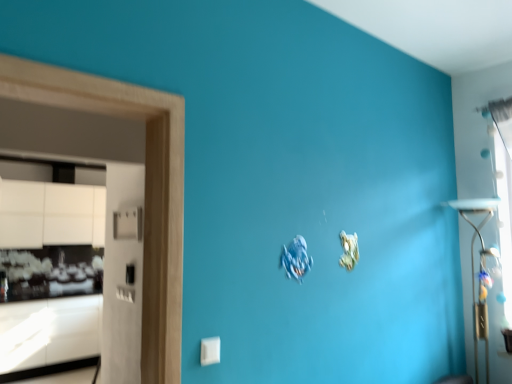
Question: Does transparent glass window at upper right have a greater width compared to white glossy cabinetry at left?

Choices:
 (A) yes
 (B) no

Answer: (B)

Question: Does transparent glass window at upper right contain white glossy cabinetry at left?

Choices:
 (A) yes
 (B) no

Answer: (B)

Question: From the image's perspective, is transparent glass window at upper right on white glossy cabinetry at left?

Choices:
 (A) yes
 (B) no

Answer: (A)

Question: Is transparent glass window at upper right oriented towards white glossy cabinetry at left?

Choices:
 (A) no
 (B) yes

Answer: (A)

Question: Is white glossy cabinetry at left at the back of transparent glass window at upper right?

Choices:
 (A) yes
 (B) no

Answer: (B)

Question: Does transparent glass window at upper right appear on the right side of white glossy cabinetry at left?

Choices:
 (A) yes
 (B) no

Answer: (A)

Question: Is white glossy cabinetry at left not within transparent glass window at upper right?

Choices:
 (A) yes
 (B) no

Answer: (A)

Question: Can you confirm if white glossy cabinetry at left is smaller than transparent glass window at upper right?

Choices:
 (A) no
 (B) yes

Answer: (A)

Question: Is transparent glass window at upper right at the back of white glossy cabinetry at left?

Choices:
 (A) no
 (B) yes

Answer: (A)

Question: From the image's perspective, would you say white glossy cabinetry at left is positioned over transparent glass window at upper right?

Choices:
 (A) no
 (B) yes

Answer: (A)

Question: Is white glossy cabinetry at left thinner than transparent glass window at upper right?

Choices:
 (A) no
 (B) yes

Answer: (A)

Question: From a real-world perspective, is white glossy cabinetry at left physically above transparent glass window at upper right?

Choices:
 (A) no
 (B) yes

Answer: (A)

Question: Considering the positions of point (510, 314) and point (76, 306), is point (510, 314) closer or farther from the camera than point (76, 306)?

Choices:
 (A) farther
 (B) closer

Answer: (B)